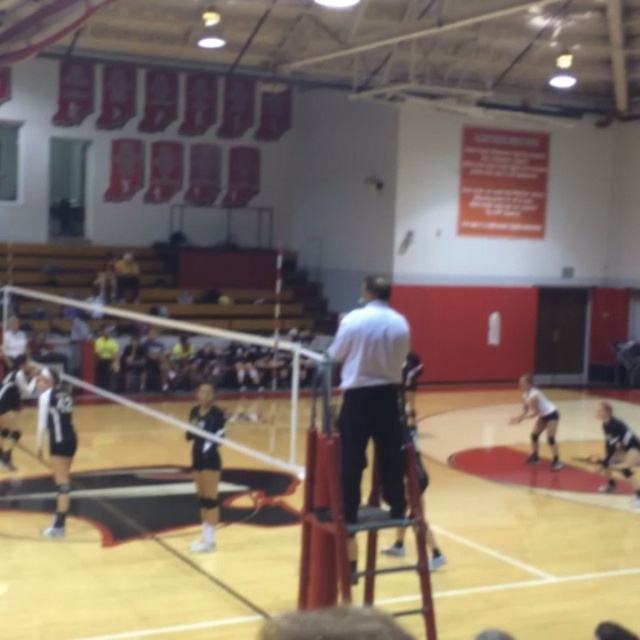
You are a photographer standing at the back of the gymnasium. You want to take a photo of both the black jersey at left and the black jersey at lower right in the same frame. Which direction should you move to ensure both are visible?

You should move to the right to ensure both the black jersey at left and the black jersey at lower right are visible in the frame since the black jersey at left is to the left of the black jersey at lower right, so moving right would allow you to capture both in the same shot.

You are a spectator sitting in the bleachers and want to take a photo of the black uniform at center. According to the court coordinates, where should you aim your camera?

The black uniform at center is located at point (x=204, y=488), so you should aim your camera at those coordinates to capture the player in the black uniform at center.